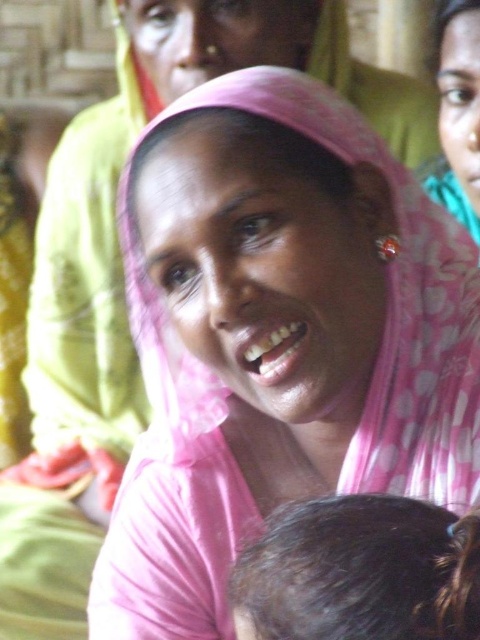
You are a photographer adjusting the camera to focus on the pink fabric headscarf at center and the dark brown hair at lower center. The camera has a minimum focus distance of 15 inches. Can both objects be in focus simultaneously?

The pink fabric headscarf at center and dark brown hair at lower center are 15.13 inches apart from each other. Since the distance between them is just over 15 inches, the camera might struggle to keep both in focus simultaneously depending on the lens used. However, the exact capability depends on the lens and aperture setting. For optimal results, use a smaller aperture for a deeper depth of field.

You are an AI analyzing the image. The point coordinates are given in the range of 0 to 1, where 0 is the bottom and 1 is the top of the image. The pink fabric headscarf at center is represented by point (394, 307). What is the vertical position of the pink fabric headscarf at center relative to the image? Is it closer to the bottom or the top?

The pink fabric headscarf at center is represented by point (394, 307). The vertical coordinate is 0.821, which is closer to 1, so it is closer to the top of the image.

You are taking a photo with a camera. There is a point at coordinate (325, 552) in the image. If the camera has a minimum focus distance of 20 inches, will the point be in focus?

The point at coordinate (325, 552) is 22.40 inches away from the camera. Since the minimum focus distance is 20 inches, the point is beyond the minimum distance, so it will be in focus.